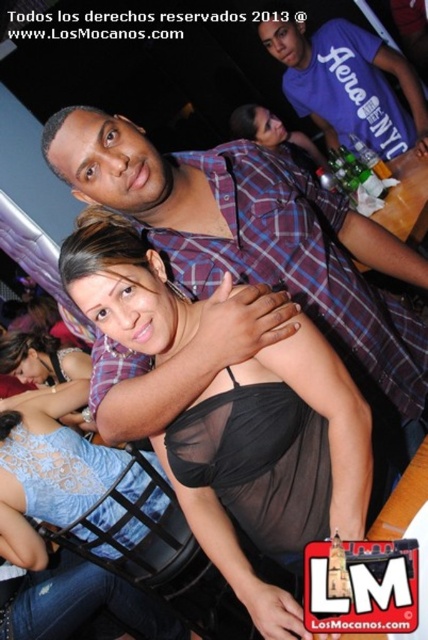
Question: Is black sheer dress at center positioned at the back of purple cotton t-shirt at upper right?

Choices:
 (A) yes
 (B) no

Answer: (B)

Question: Which point is farther from the camera taking this photo?

Choices:
 (A) (195, 291)
 (B) (386, 68)
 (C) (143, 256)

Answer: (B)

Question: Estimate the real-world distances between objects in this image. Which object is closer to the black sheer dress at center?

Choices:
 (A) purple cotton t-shirt at upper right
 (B) plaid shirt at center

Answer: (B)

Question: Where is plaid shirt at center located in relation to black sheer dress at center in the image?

Choices:
 (A) left
 (B) right

Answer: (B)

Question: Which point is farther from the camera taking this photo?

Choices:
 (A) (252, 204)
 (B) (297, 61)
 (C) (136, 324)

Answer: (B)

Question: Can you confirm if plaid shirt at center is bigger than purple cotton t-shirt at upper right?

Choices:
 (A) yes
 (B) no

Answer: (B)